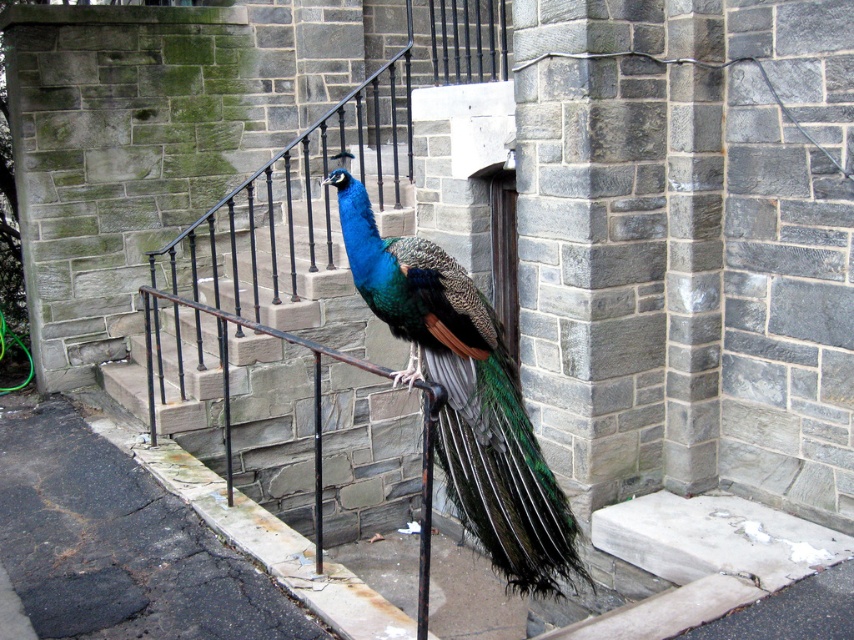
Does shiny blue peacock at center have a greater height compared to gray stone stairs at center?

In fact, shiny blue peacock at center may be shorter than gray stone stairs at center.

Is shiny blue peacock at center wider than gray stone stairs at center?

No.

What do you see at coordinates (465, 397) in the screenshot? I see `shiny blue peacock at center` at bounding box center [465, 397].

You are a GUI agent. You are given a task and a screenshot of the screen. Output one action in this format:
    pyautogui.click(x=<x>, y=<y>)
    Task: Click on the shiny blue peacock at center
    Image resolution: width=854 pixels, height=640 pixels.
    Given the screenshot: What is the action you would take?
    pyautogui.click(x=465, y=397)